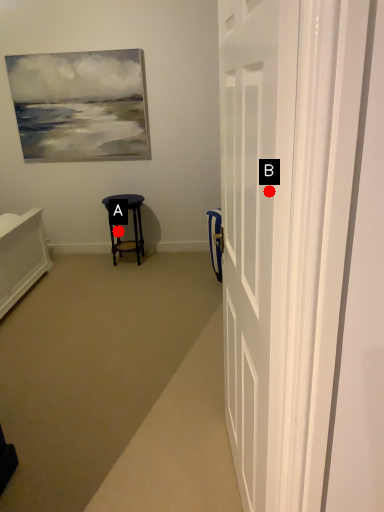
Question: Two points are circled on the image, labeled by A and B beside each circle. Which point is further to the camera?

Choices:
 (A) A is further
 (B) B is further

Answer: (A)